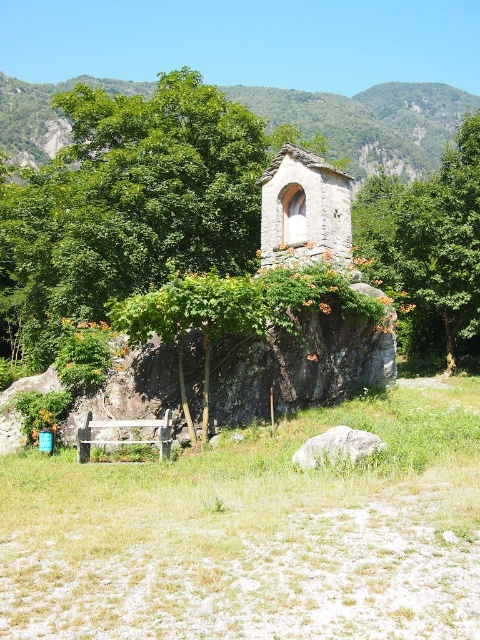
Consider the image. You are standing in front of the stone structure and want to take a photo. You notice two points marked in the scene. The first point is at coordinate point (x=458, y=96) and the second is at point (x=361, y=448). Which point is closer to your camera when taking the photo?

Point (x=361, y=448) is closer to the camera than point (x=458, y=96) because the description states that point (x=458, y=96) is further away from the camera compared to point (x=361, y=448).

You are standing at the base of the green stone mountain at upper center. You want to climb to the top. If your average climbing speed is 10 feet per minute, how many minutes will it take you to reach the top?

The green stone mountain at upper center and viewer are 516.27 feet apart from each other. At a speed of 10 feet per minute, it would take approximately 51.63 minutes to reach the top.

You are standing in the serene outdoor scene and want to take a photo of the green leafy tree at center. If your camera can focus on objects up to 150 feet away, will you need to move closer to get a clear shot?

The green leafy tree at center is 153.71 feet from the viewer, which is beyond the camera focus range of 150 feet. You need to move closer to get a clear shot.